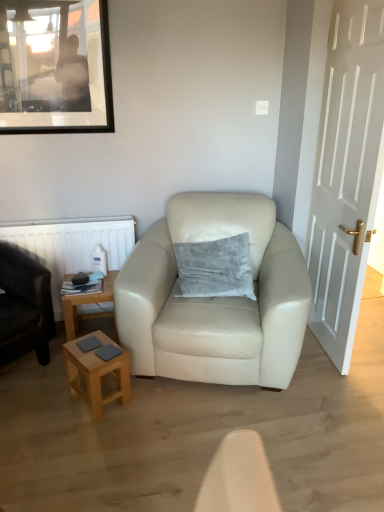
Identify the location of free space above woodenwoodentable at lower left (from a real-world perspective). [93, 281].